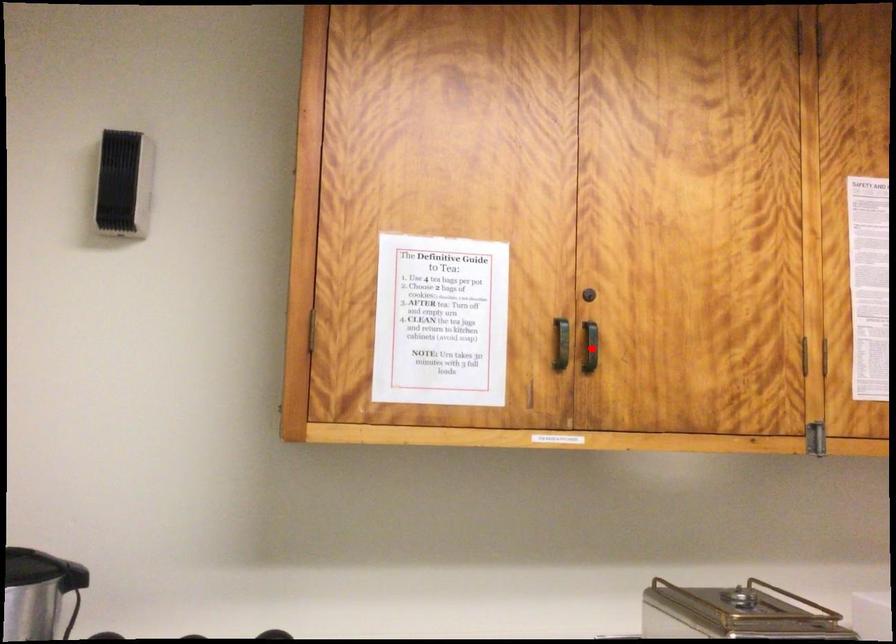
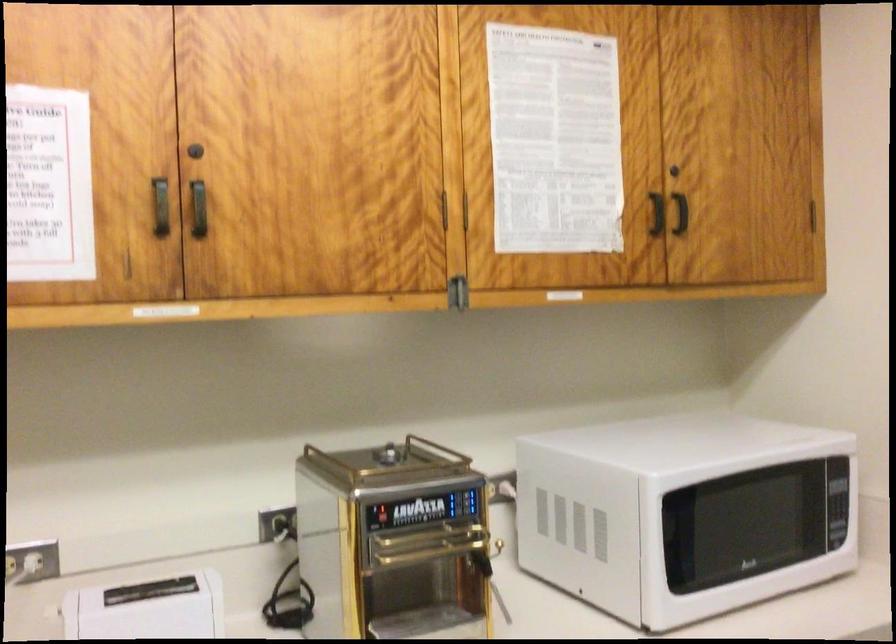
In the second image, find the point that corresponds to the highlighted location in the first image.

(197, 209)